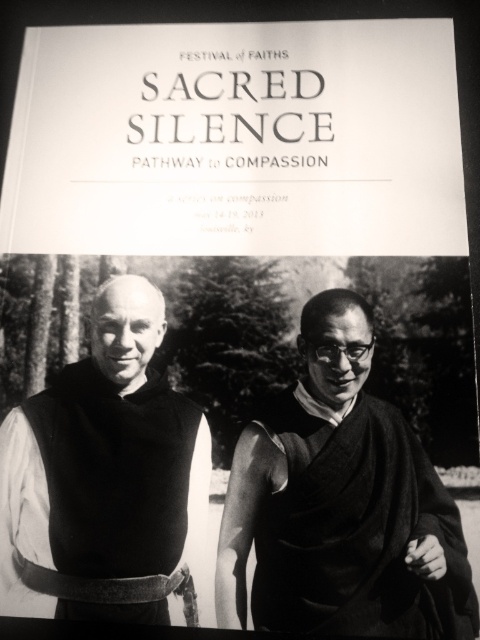
Question: Which of the following is the closest to the observer?

Choices:
 (A) matte black vest at left
 (B) white paper at upper center

Answer: (A)

Question: Among these objects, which one is farthest from the camera?

Choices:
 (A) black woolen robe at right
 (B) white paper at upper center

Answer: (B)

Question: Which of the following is the closest to the observer?

Choices:
 (A) (320, 420)
 (B) (116, 243)
 (C) (187, 497)

Answer: (C)

Question: Is the position of matte black vest at left more distant than that of black woolen robe at right?

Choices:
 (A) yes
 (B) no

Answer: (A)

Question: Is the position of white paper at upper center less distant than that of matte black vest at left?

Choices:
 (A) yes
 (B) no

Answer: (B)

Question: Does matte black vest at left have a lesser width compared to black woolen robe at right?

Choices:
 (A) no
 (B) yes

Answer: (A)